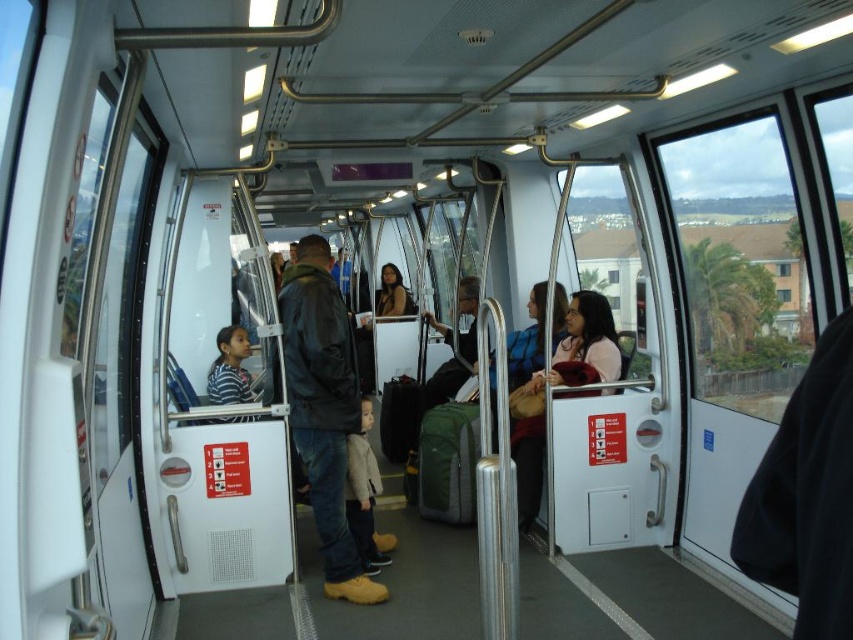
You are a passenger in the modern cable car and need to place a rectangular bag that is 1.2 meters wide between the leather jacket at center and the light beige sweater at center. Can the bag fit between them?

The leather jacket at center is wider than the light beige sweater at center. However, the combined width of both items would need to be considered to determine if there is enough space. Since the bag is 1.2 meters wide, but the exact combined width of the jackets and sweaters isn

Consider the image. You are a passenger in the cable car and you want to put your leather jacket at center and light beige sweater at center into the luggage rack above. Which one should you place first to the left side of the rack?

You should place the leather jacket at center first to the left side of the rack because it is already positioned to the left of the light beige sweater at center in the cabin.

You are a passenger in the cable car and want to retrieve your light beige sweater at center. However, there is a leather jacket at center in the way. Can you reach your sweater without moving the jacket?

The leather jacket at center is positioned over light beige sweater at center, so you cannot reach the sweater without moving the jacket.